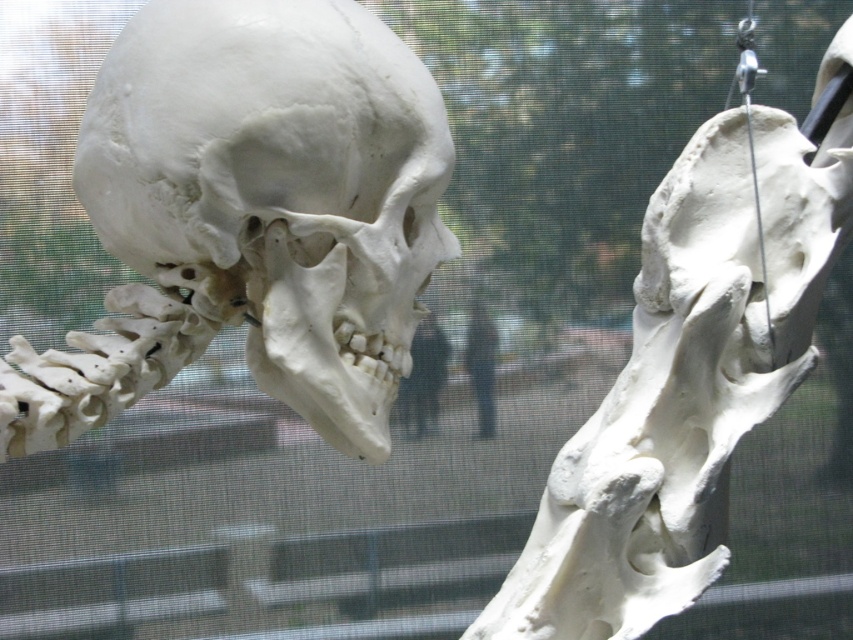
You are an artist trying to draw the scene. You notice the white matte skull at upper left and the black matte person at center. Which object should you draw first if you want to follow the size order from largest to smallest?

You should draw the white matte skull at upper left first because it is bigger than the black matte person at center according to the description.

You are a medical student standing 6 feet away from the skeleton. You need to reach the white bone at right to measure its dimensions. Can you comfortably reach it without moving closer?

The white bone at right is 6.03 feet away from the camera, so since you are standing 6 feet away, you can comfortably reach it without moving closer.

You are an observer looking at the skeleton display. You notice the white matte skull at upper left and the dark blue jeans at center. Which object is positioned higher in the image?

The white matte skull at upper left is positioned higher than the dark blue jeans at center.